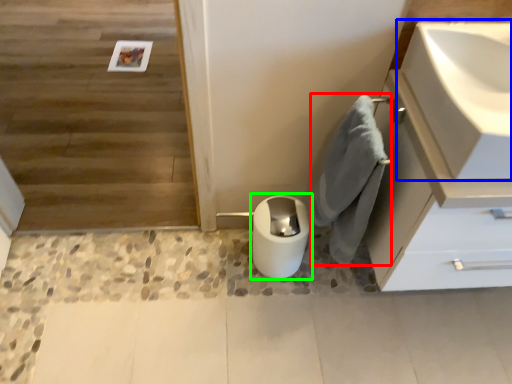
Question: Which is farther away from bath towel (highlighted by a red box)? sink (highlighted by a blue box) or toilet bowl (highlighted by a green box)?

Choices:
 (A) sink
 (B) toilet bowl

Answer: (A)